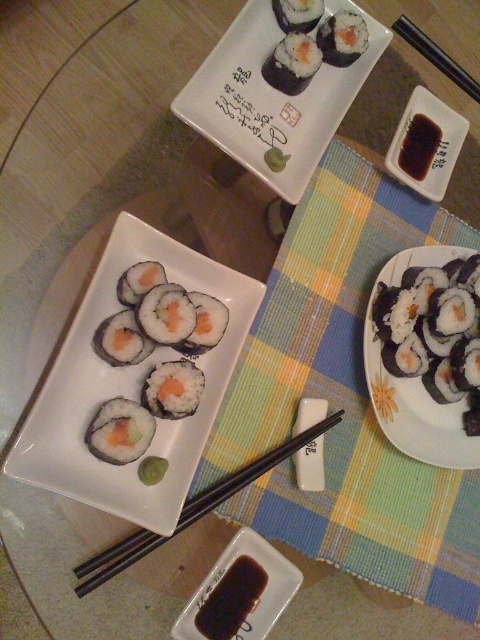
In the scene shown: Which is more to the left, sushi at center or black plastic chopsticks at upper right?

sushi at center is more to the left.

Who is more distant from viewer, (277, 74) or (420, 45)?

The point (420, 45) is behind.

Between point (288, 80) and point (420, 52), which one is positioned behind?

Point (420, 52)

You are a GUI agent. You are given a task and a screenshot of the screen. Output one action in this format:
    pyautogui.click(x=<x>, y=<y>)
    Task: Click on the sushi at center
    The height and width of the screenshot is (640, 480).
    Given the screenshot: What is the action you would take?
    pyautogui.click(x=291, y=64)

Is black matte sushi rolls at center smaller than green rice roll at center?

Incorrect, black matte sushi rolls at center is not smaller in size than green rice roll at center.

Does black matte sushi rolls at center have a greater height compared to green rice roll at center?

Yes.

At what (x,y) coordinates should I click in order to perform the action: click on black matte sushi rolls at center. Please return your answer as a coordinate pair (x, y). The height and width of the screenshot is (640, 480). Looking at the image, I should click on (416, 385).

Locate an element on the screen. black matte sushi rolls at center is located at coordinates (416, 385).

Does black plastic chopsticks at center have a lesser height compared to green matte cucumber at center?

No.

Which is in front, point (96, 564) or point (144, 481)?

Point (96, 564) is in front.

I want to click on black plastic chopsticks at center, so click(x=192, y=509).